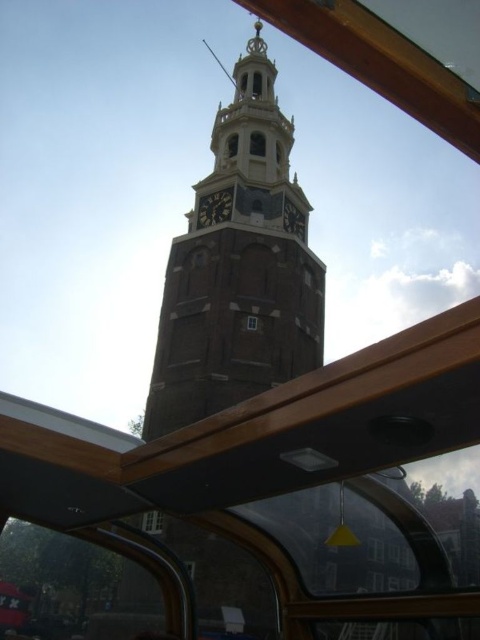
You are on a boat and want to take a photo of the historic clock tower through the clear glass window at center. However, the dark brown wooden clock at upper center is blocking your view. Can you move the clock to the right to get a clear shot? Explain why or why not based on their positions.

The dark brown wooden clock at upper center is to the left of the clear glass window at center. Since the clock is already positioned to the left of the window, moving it further to the right would place it in front of the window, blocking the view more. Therefore, moving it to the right isn not advisable as it would worsen the obstruction.

You are standing inside the boat and looking at the dark brown wooden clock at upper center. If you want to throw a small pebble to hit the clock, will you need to throw it upwards or downwards?

The dark brown wooden clock at upper center is 244.32 feet away from the viewer. Since the clock is above the viewer, you would need to throw the pebble upwards to reach it.